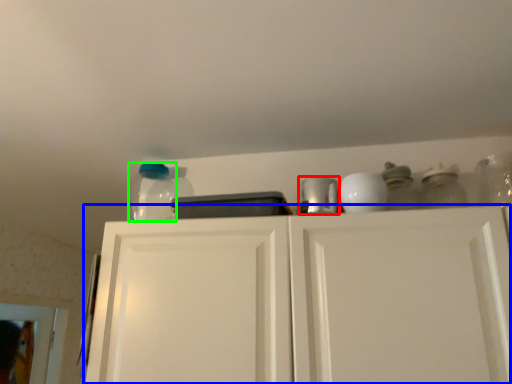
Question: Which object is positioned closest to appliance (highlighted by a red box)? Select from cabinetry (highlighted by a blue box) and glass jar (highlighted by a green box).

Choices:
 (A) cabinetry
 (B) glass jar

Answer: (A)